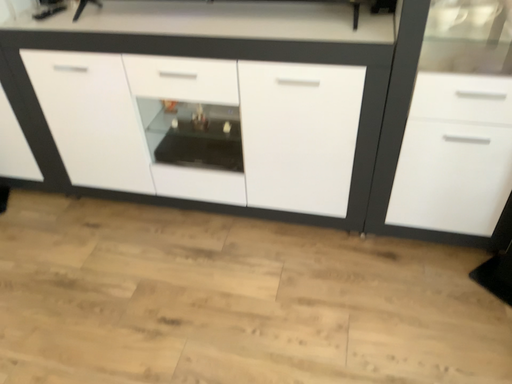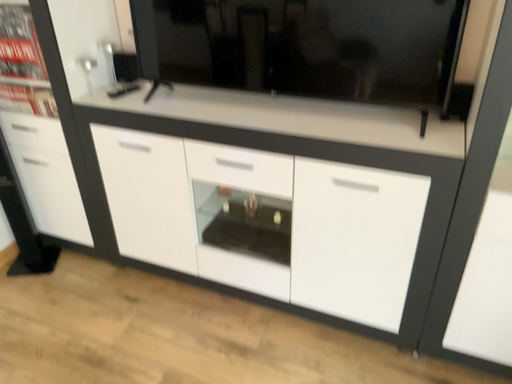
Question: Which way did the camera rotate in the video?

Choices:
 (A) rotated upward
 (B) rotated downward

Answer: (A)